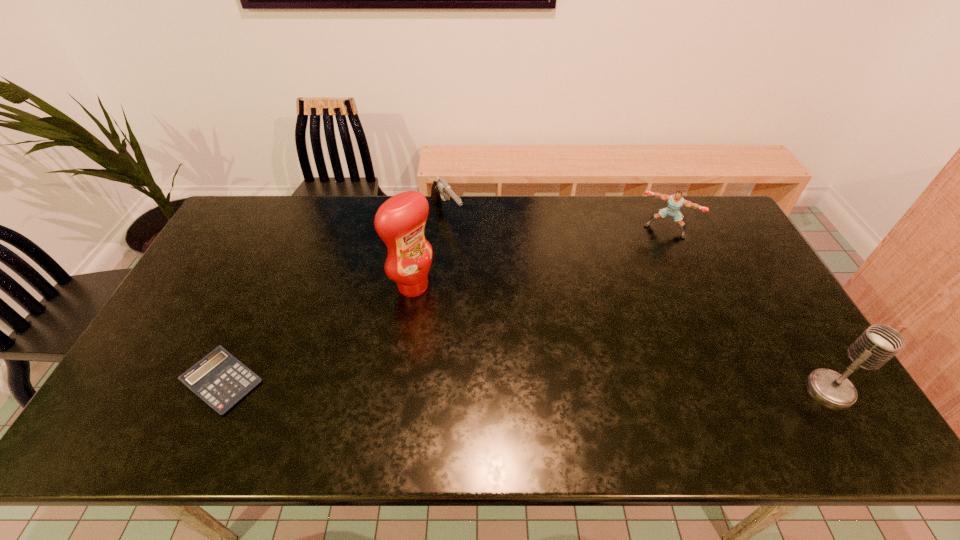
Where is `calculator`? Image resolution: width=960 pixels, height=540 pixels. calculator is located at coordinates (219, 379).

You are a GUI agent. You are given a task and a screenshot of the screen. Output one action in this format:
    pyautogui.click(x=<x>, y=<y>)
    Task: Click on the leftmost object
    
    Given the screenshot: What is the action you would take?
    pyautogui.click(x=219, y=379)

Locate an element on the screen. Image resolution: width=960 pixels, height=540 pixels. microphone is located at coordinates (878, 343).

The width and height of the screenshot is (960, 540). Identify the location of the fourth shortest object. (878, 343).

The image size is (960, 540). I want to click on the fourth object from left to right, so click(x=675, y=202).

Locate an element on the screen. The height and width of the screenshot is (540, 960). condiment is located at coordinates (400, 221).

The image size is (960, 540). What are the coordinates of `the tallest object` in the screenshot? It's located at (400, 221).

This screenshot has width=960, height=540. I want to click on gun, so click(x=440, y=189).

Find the location of `vacant space located on the right of the calculator`. vacant space located on the right of the calculator is located at coordinates (367, 382).

This screenshot has height=540, width=960. What are the coordinates of `vacant space located on the back of the second tallest object` in the screenshot? It's located at (781, 308).